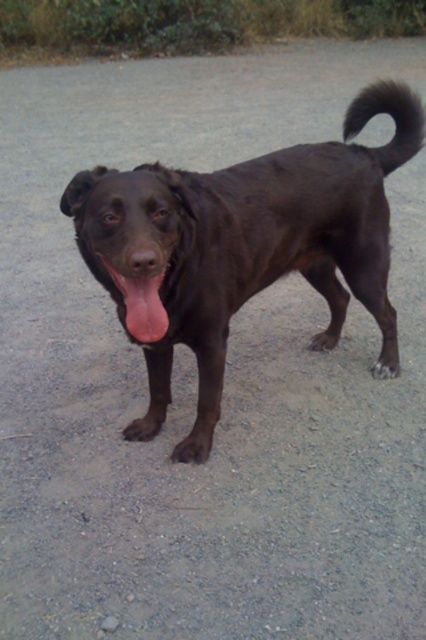
Is shiny black dog at center to the left of pink glossy tongue at center from the viewer's perspective?

Incorrect, shiny black dog at center is not on the left side of pink glossy tongue at center.

Is shiny black dog at center above pink glossy tongue at center?

Indeed, shiny black dog at center is positioned over pink glossy tongue at center.

Looking at this image, measure the distance between point (x=109, y=204) and camera.

1.74 meters

Locate an element on the screen. The width and height of the screenshot is (426, 640). shiny black dog at center is located at coordinates (247, 244).